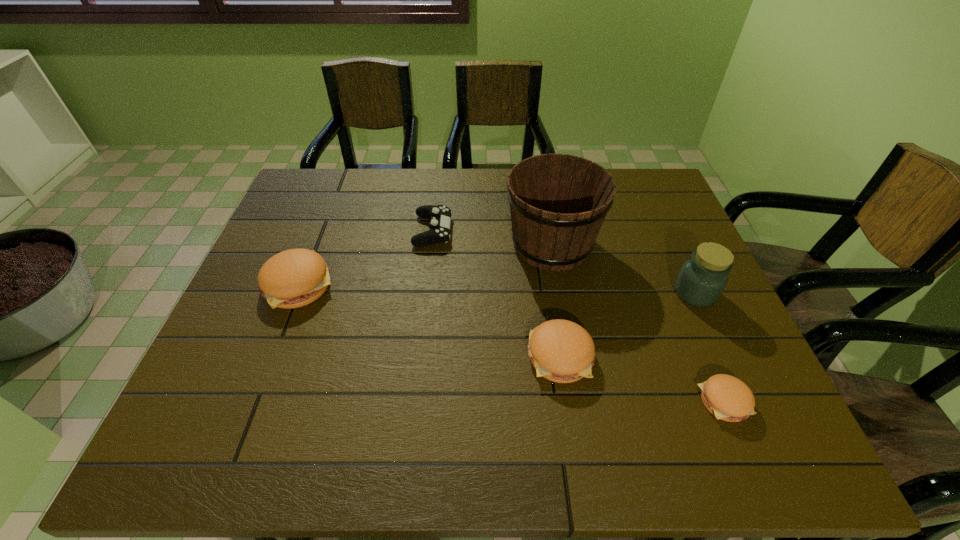
Find the location of a particular element. The height and width of the screenshot is (540, 960). blank space that satisfies the following two spatial constraints: 1. on the surface of the wine bucket; 2. on the left side of the control is located at coordinates tap(431, 244).

You are a GUI agent. You are given a task and a screenshot of the screen. Output one action in this format:
    pyautogui.click(x=<x>, y=<y>)
    Task: Click on the free space that satisfies the following two spatial constraints: 1. on the surface of the second object from left to right; 2. on the front side of the leftmost object
    The height and width of the screenshot is (540, 960).
    Given the screenshot: What is the action you would take?
    pyautogui.click(x=426, y=285)

This screenshot has width=960, height=540. I want to click on free space that satisfies the following two spatial constraints: 1. on the surface of the second shortest patty; 2. on the left side of the fifth tallest object, so click(x=419, y=356).